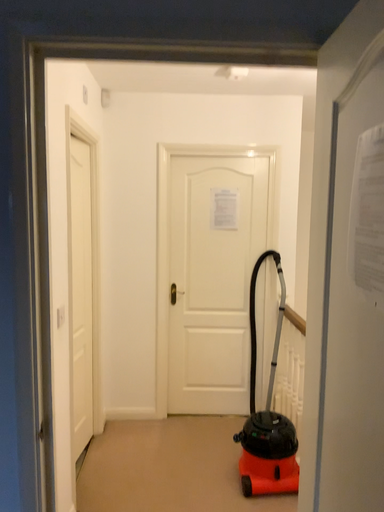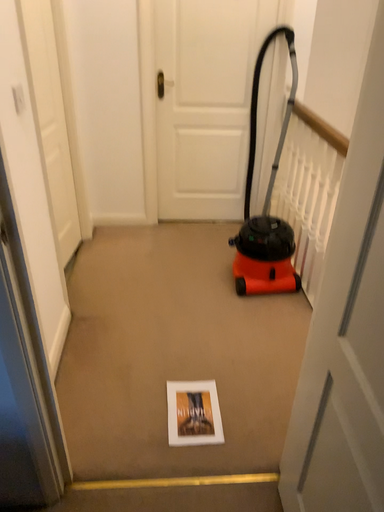
Question: Which way did the camera rotate in the video?

Choices:
 (A) rotated upward
 (B) rotated downward

Answer: (B)